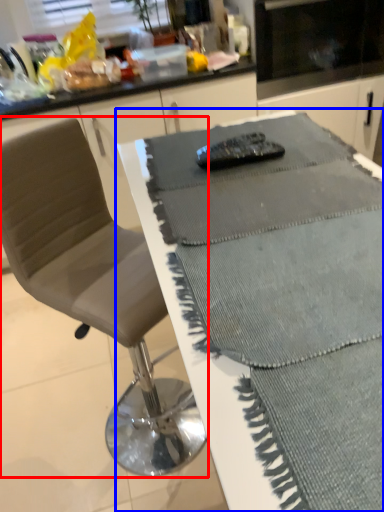
Question: Which of the following is the farthest to the observer, chair (highlighted by a red box) or table (highlighted by a blue box)?

Choices:
 (A) chair
 (B) table

Answer: (A)